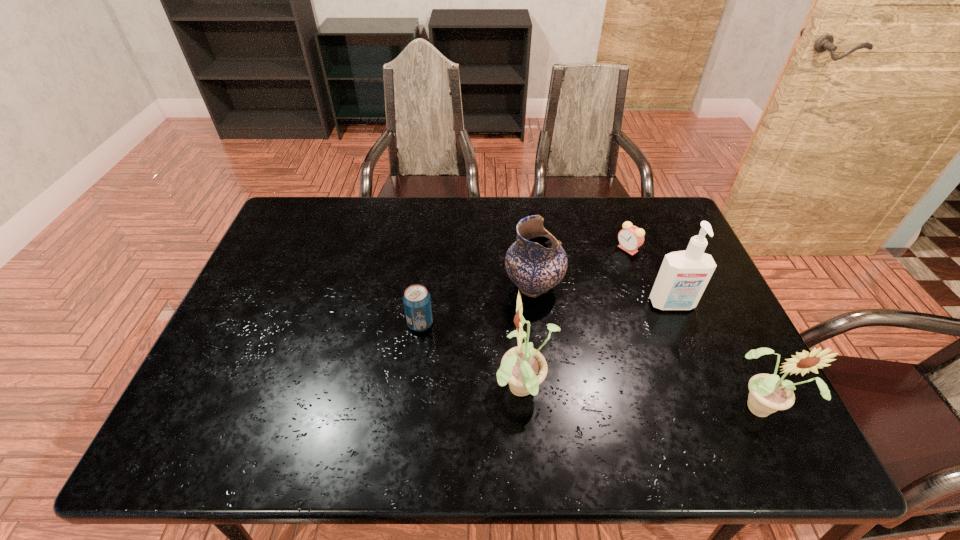
The image size is (960, 540). Identify the location of the left sunflower. (524, 368).

Identify the location of the right sunflower. The image size is (960, 540). (768, 393).

You are a GUI agent. You are given a task and a screenshot of the screen. Output one action in this format:
    pyautogui.click(x=<x>, y=<y>)
    Task: Click on the farthest object
    Image resolution: width=960 pixels, height=540 pixels.
    Given the screenshot: What is the action you would take?
    pyautogui.click(x=630, y=238)

At what (x,y) coordinates should I click in order to perform the action: click on the shortest object. Please return your answer as a coordinate pair (x, y). Image resolution: width=960 pixels, height=540 pixels. Looking at the image, I should click on (630, 238).

Locate an element on the screen. The width and height of the screenshot is (960, 540). the leftmost object is located at coordinates (417, 302).

At what (x,y) coordinates should I click in order to perform the action: click on the fifth tallest object. Please return your answer as a coordinate pair (x, y). Looking at the image, I should click on (417, 302).

Find the location of a particular element. Image resolution: width=960 pixels, height=540 pixels. pottery is located at coordinates (536, 262).

Identify the location of cleansing agent. Image resolution: width=960 pixels, height=540 pixels. (683, 276).

You are a GUI agent. You are given a task and a screenshot of the screen. Output one action in this format:
    pyautogui.click(x=<x>, y=<y>)
    Task: Click on the free space located 0.240m on the front-facing side of the left sunflower
    
    Given the screenshot: What is the action you would take?
    pyautogui.click(x=391, y=391)

Locate an element on the screen. The height and width of the screenshot is (540, 960). vacant position located on the front-facing side of the left sunflower is located at coordinates (348, 391).